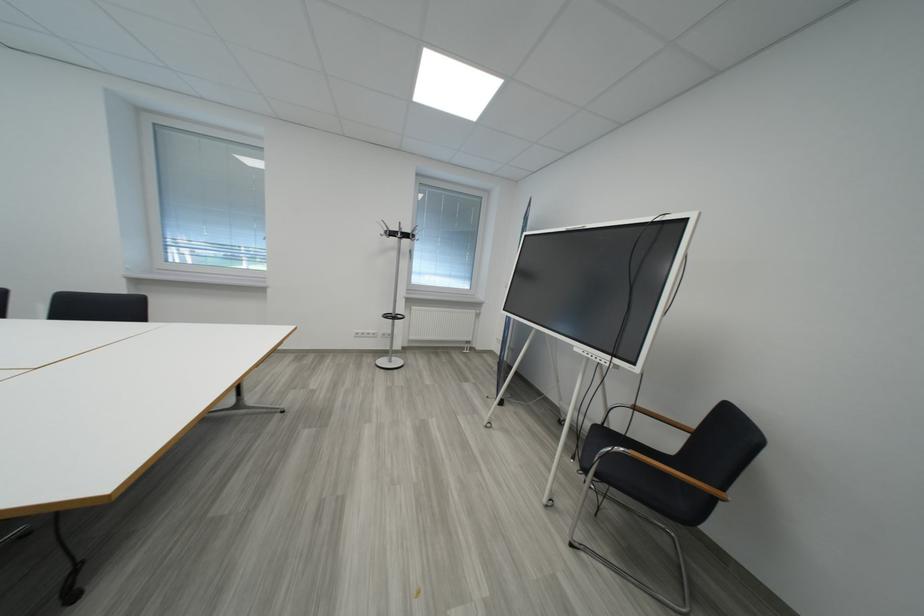
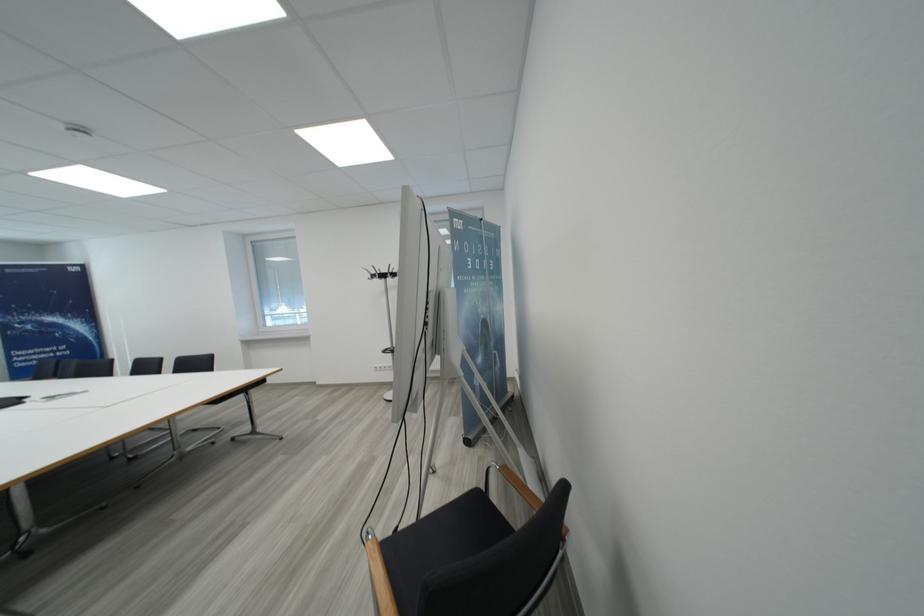
Find the pixel in the second image that matches pixel 412 238 in the first image.

(390, 278)